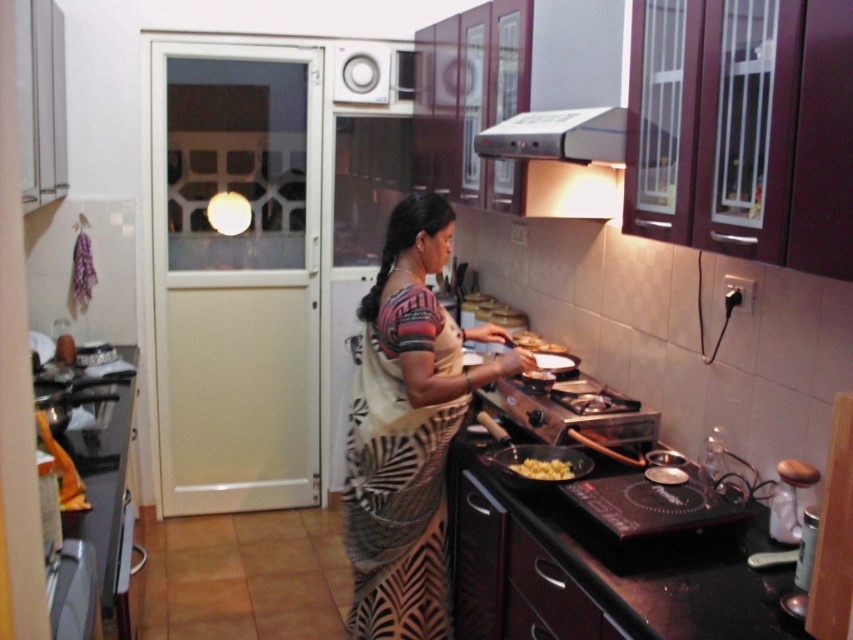
You are a customer in a fabric store and see a point marked at coordinates (408, 429). The store has a variety of fabrics displayed on shelves. Which fabric is located at that point?

The point at coordinates (408, 429) indicates the location of the printed cotton saree at center.

You are a fashion designer visiting a kitchen and see the printed cotton saree at center and the yellow matte food at lower center. Which item is bigger in size?

The printed cotton saree at center is larger in size compared to the yellow matte food at lower center.